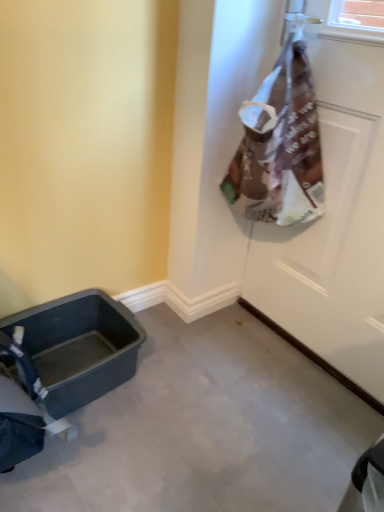
Question: Considering the relative sizes of matte plastic baby carriage at lower left and white matte door at upper right in the image provided, is matte plastic baby carriage at lower left smaller than white matte door at upper right?

Choices:
 (A) no
 (B) yes

Answer: (B)

Question: Is matte plastic baby carriage at lower left wider than white matte door at upper right?

Choices:
 (A) no
 (B) yes

Answer: (B)

Question: From a real-world perspective, does matte plastic baby carriage at lower left stand above white matte door at upper right?

Choices:
 (A) no
 (B) yes

Answer: (A)

Question: From the image's perspective, is matte plastic baby carriage at lower left above white matte door at upper right?

Choices:
 (A) yes
 (B) no

Answer: (B)

Question: Can you confirm if matte plastic baby carriage at lower left is positioned to the left of white matte door at upper right?

Choices:
 (A) yes
 (B) no

Answer: (A)

Question: Is matte plastic baby carriage at lower left aimed at white matte door at upper right?

Choices:
 (A) no
 (B) yes

Answer: (A)

Question: Can you confirm if white matte door at upper right is bigger than matte plastic baby carriage at lower left?

Choices:
 (A) no
 (B) yes

Answer: (B)

Question: Considering the relative sizes of white matte door at upper right and matte plastic baby carriage at lower left in the image provided, is white matte door at upper right taller than matte plastic baby carriage at lower left?

Choices:
 (A) yes
 (B) no

Answer: (A)

Question: From the image's perspective, does white matte door at upper right appear higher than matte plastic baby carriage at lower left?

Choices:
 (A) yes
 (B) no

Answer: (A)

Question: Is white matte door at upper right at the left side of matte plastic baby carriage at lower left?

Choices:
 (A) yes
 (B) no

Answer: (B)

Question: Is white matte door at upper right directly adjacent to matte plastic baby carriage at lower left?

Choices:
 (A) no
 (B) yes

Answer: (A)

Question: From the image's perspective, is white matte door at upper right beneath matte plastic baby carriage at lower left?

Choices:
 (A) yes
 (B) no

Answer: (B)

Question: Considering the positions of matte plastic baby carriage at lower left and white matte door at upper right in the image, is matte plastic baby carriage at lower left wider or thinner than white matte door at upper right?

Choices:
 (A) wide
 (B) thin

Answer: (A)